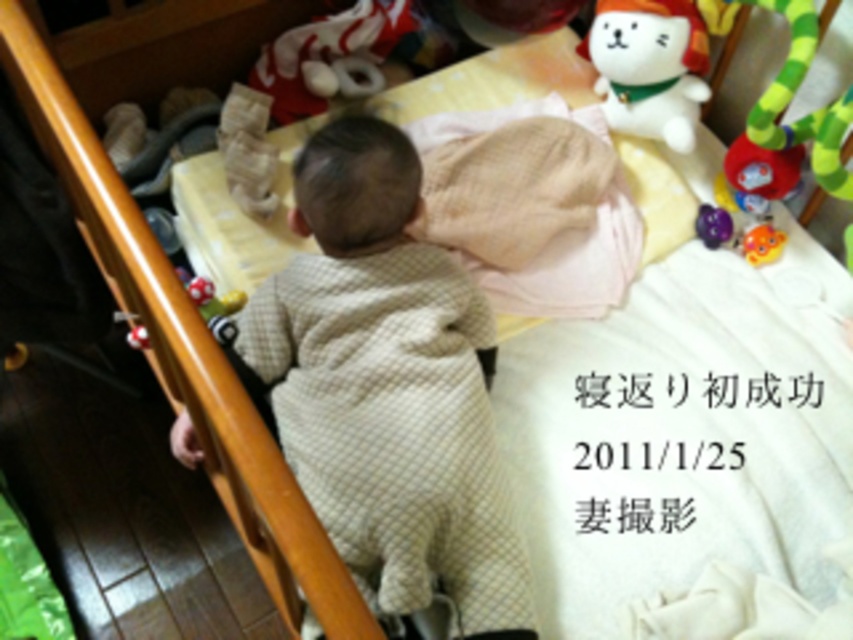
You are a photographer standing in the room with the light beige fabric baby at center. You want to take a photo of the baby from a distance that allows you to capture the entire crib and the baby in focus. If your camera has a minimum focusing distance of 4 feet, will you be able to take the photo without moving closer?

The light beige fabric baby at center and camera are 3.51 feet apart from each other. Since the minimum focusing distance of the camera is 4 feet, you are too close to capture the entire crib and baby in focus without moving back further.

You are a parent looking at the crib. You see the light beige fabric baby at center and the yellow rubber duck at upper right. Which object is positioned higher up in the image?

The yellow rubber duck at upper right is positioned higher up in the image than the light beige fabric baby at center.

You are standing in the room and want to place a small gift at point (669, 396) in the crib. The gift is 2 feet in diameter. Is there enough space at that point to place the gift without it overlapping with any objects?

The distance of point (669, 396) from camera is 4.55 feet. Since the gift is 2 feet in diameter, there is sufficient space to place it at that point as the distance allows for placement without overlapping.